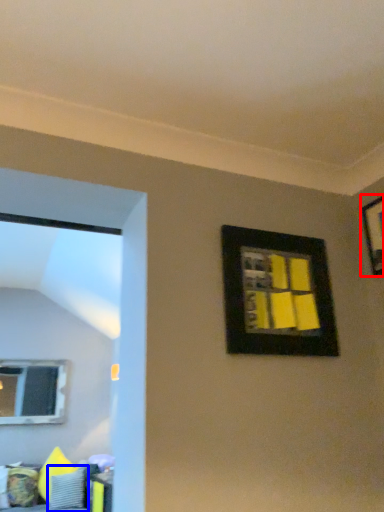
Question: Which point is closer to the camera, picture frame (highlighted by a red box) or pillow (highlighted by a blue box)?

Choices:
 (A) picture frame
 (B) pillow

Answer: (A)